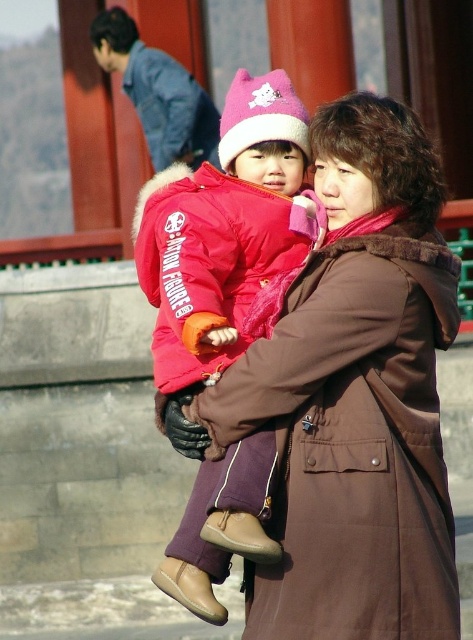
Question: Which object is closer to the camera taking this photo?

Choices:
 (A) matte pink jacket at center
 (B) matte red jacket at center

Answer: (B)

Question: Is brown matte coat at center further to the viewer compared to matte pink jacket at center?

Choices:
 (A) no
 (B) yes

Answer: (B)

Question: Is brown matte coat at center wider than matte pink jacket at center?

Choices:
 (A) no
 (B) yes

Answer: (A)

Question: Can you confirm if brown matte coat at center is positioned to the left of matte red jacket at center?

Choices:
 (A) yes
 (B) no

Answer: (B)

Question: Which point is closer to the camera?

Choices:
 (A) matte pink jacket at center
 (B) matte red jacket at center

Answer: (B)

Question: Which point appears closest to the camera in this image?

Choices:
 (A) (450, 253)
 (B) (161, 336)

Answer: (A)